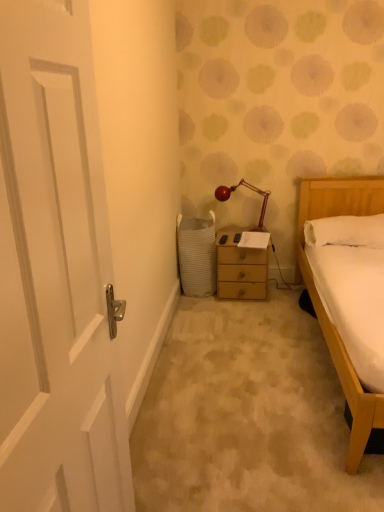
Question: Considering the relative positions of white glossy door at left and white soft pillow at right in the image provided, is white glossy door at left behind white soft pillow at right?

Choices:
 (A) yes
 (B) no

Answer: (B)

Question: Is white glossy door at left aimed at white soft pillow at right?

Choices:
 (A) no
 (B) yes

Answer: (A)

Question: From the image's perspective, is white glossy door at left above white soft pillow at right?

Choices:
 (A) yes
 (B) no

Answer: (B)

Question: Considering the relative positions of white glossy door at left and white soft pillow at right in the image provided, is white glossy door at left to the left of white soft pillow at right from the viewer's perspective?

Choices:
 (A) yes
 (B) no

Answer: (A)

Question: From a real-world perspective, is white glossy door at left over white soft pillow at right?

Choices:
 (A) yes
 (B) no

Answer: (A)

Question: From the image's perspective, is wooden nightstand at center positioned above or below metallic red lamp at center?

Choices:
 (A) above
 (B) below

Answer: (B)

Question: Is point (238, 280) positioned closer to the camera than point (251, 185)?

Choices:
 (A) closer
 (B) farther

Answer: (A)

Question: From a real-world perspective, is wooden nightstand at center physically located above or below metallic red lamp at center?

Choices:
 (A) above
 (B) below

Answer: (B)

Question: Would you say wooden nightstand at center is inside or outside metallic red lamp at center?

Choices:
 (A) outside
 (B) inside

Answer: (A)

Question: From the image's perspective, is white woven laundry basket at lower center positioned above or below wooden nightstand at center?

Choices:
 (A) below
 (B) above

Answer: (B)

Question: Is white woven laundry basket at lower center taller or shorter than wooden nightstand at center?

Choices:
 (A) short
 (B) tall

Answer: (B)

Question: Is white woven laundry basket at lower center wider or thinner than wooden nightstand at center?

Choices:
 (A) thin
 (B) wide

Answer: (B)

Question: Would you say white woven laundry basket at lower center is inside or outside wooden nightstand at center?

Choices:
 (A) inside
 (B) outside

Answer: (B)

Question: Is metallic red lamp at center bigger or smaller than wooden nightstand at center?

Choices:
 (A) big
 (B) small

Answer: (B)

Question: Looking at their shapes, would you say metallic red lamp at center is wider or thinner than wooden nightstand at center?

Choices:
 (A) wide
 (B) thin

Answer: (B)